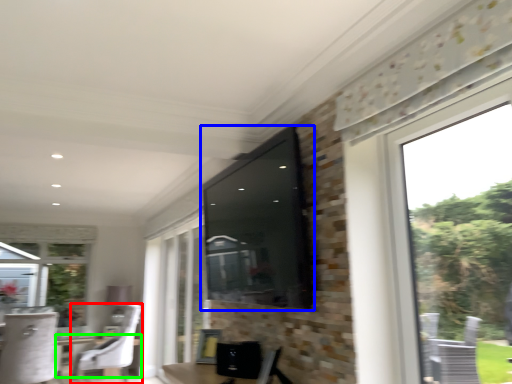
Question: Estimate the real-world distances between objects in this image. Which object is closer to chair (highlighted by a red box), window screen (highlighted by a blue box) or round table (highlighted by a green box)?

Choices:
 (A) window screen
 (B) round table

Answer: (B)